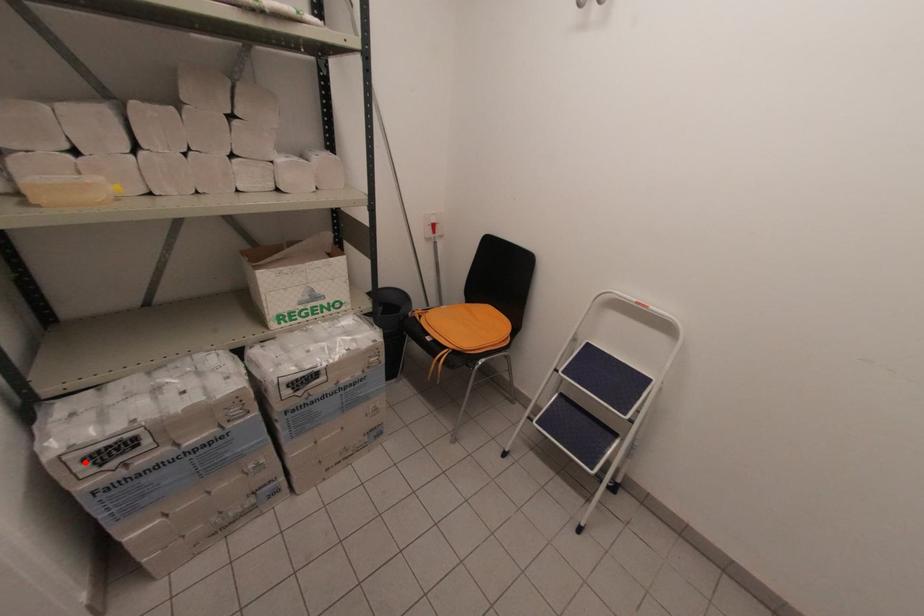
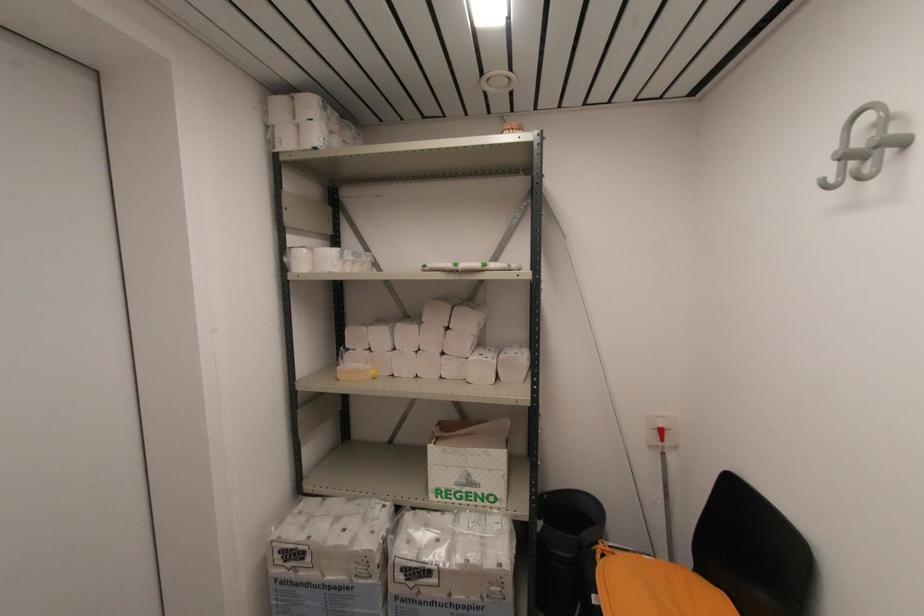
Question: I am providing you with two images of the same scene from different viewpoints. A red point is shown in image1. For the corresponding object point in image2, is it positioned nearer or farther from the camera?

Choices:
 (A) Nearer
 (B) Farther

Answer: (B)